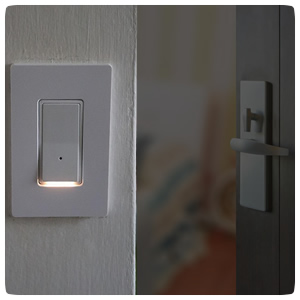
I want to click on door frame, so click(x=96, y=257).